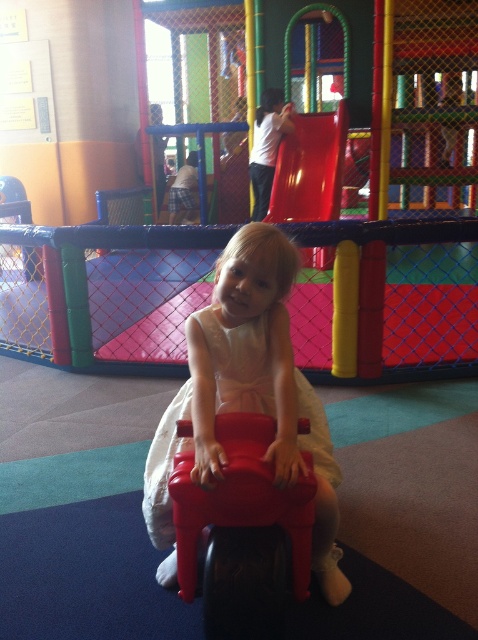
Does rubberized red toy car at center lie behind white satin dress at center?

That is False.

Does point (186, 561) come farther from viewer compared to point (259, 340)?

That is False.

Where is `rubberized red toy car at center`? rubberized red toy car at center is located at coordinates (241, 499).

Does rubberized red toy car at center have a lesser height compared to shiny plastic slide at upper center?

Correct, rubberized red toy car at center is not as tall as shiny plastic slide at upper center.

Where is `rubberized red toy car at center`? The height and width of the screenshot is (640, 478). rubberized red toy car at center is located at coordinates (241, 499).

Is white satin dress at center smaller than shiny plastic slide at upper center?

Yes, white satin dress at center is smaller than shiny plastic slide at upper center.

Who is taller, white satin dress at center or shiny plastic slide at upper center?

shiny plastic slide at upper center is taller.

Who is more distant from viewer, (333, 486) or (318, 173)?

The point (318, 173) is more distant.

In order to click on white satin dress at center in this screenshot , I will do `click(239, 362)`.